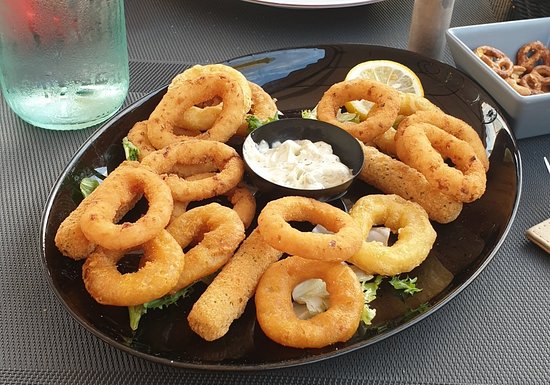
In order to click on white square bowl in this screenshot , I will do `click(453, 32)`.